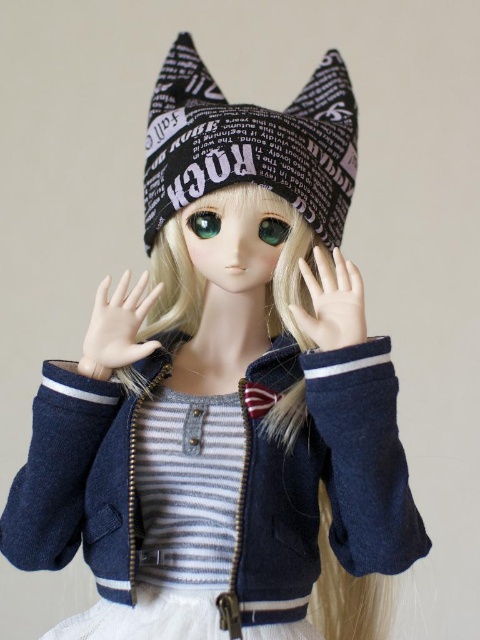
You are a tailor measuring the doll for a new glove. The glove needs to fit either the smooth skin hand at center or the smooth porcelain hand at center. Which hand requires a larger glove size?

The smooth skin hand at center requires a larger glove size because it has a larger size compared to the smooth porcelain hand at center.

You are positioning two points on the doll image. The first point is at point (x=326, y=330) and the second is at point (x=203, y=220). Which point is closer to the viewer?

Point (x=326, y=330) is in front of point (x=203, y=220), so it is closer to the viewer.